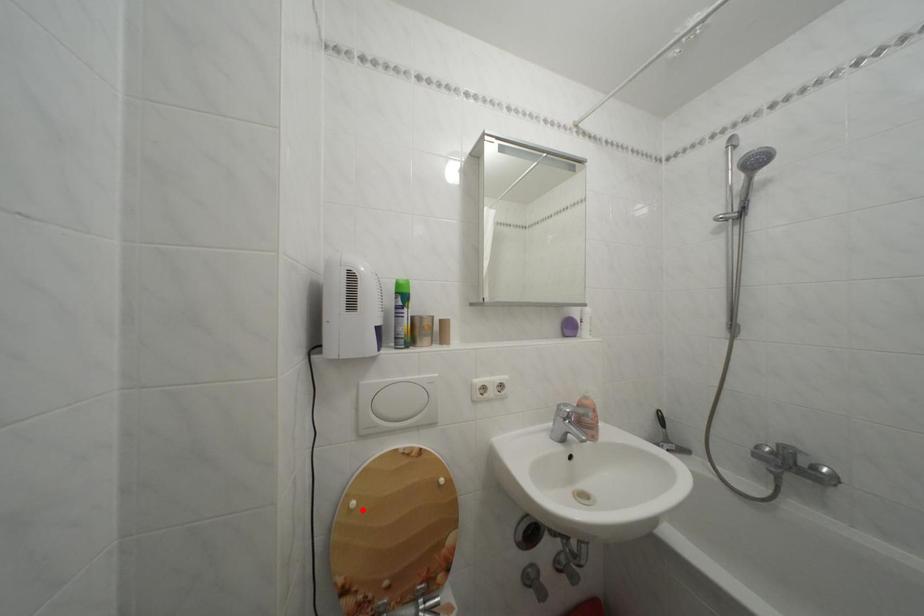
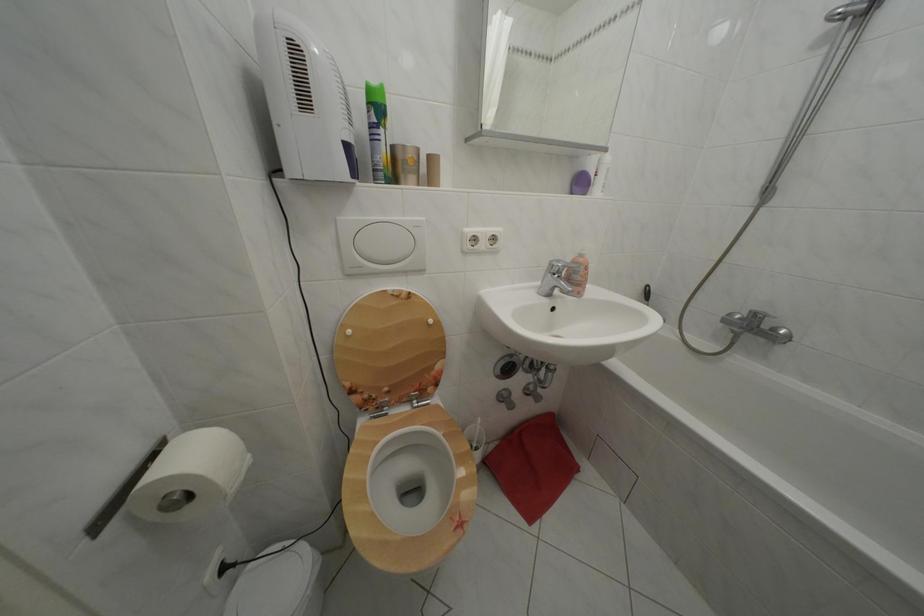
In the second image, find the point that corresponds to the highlighted location in the first image.

(358, 338)